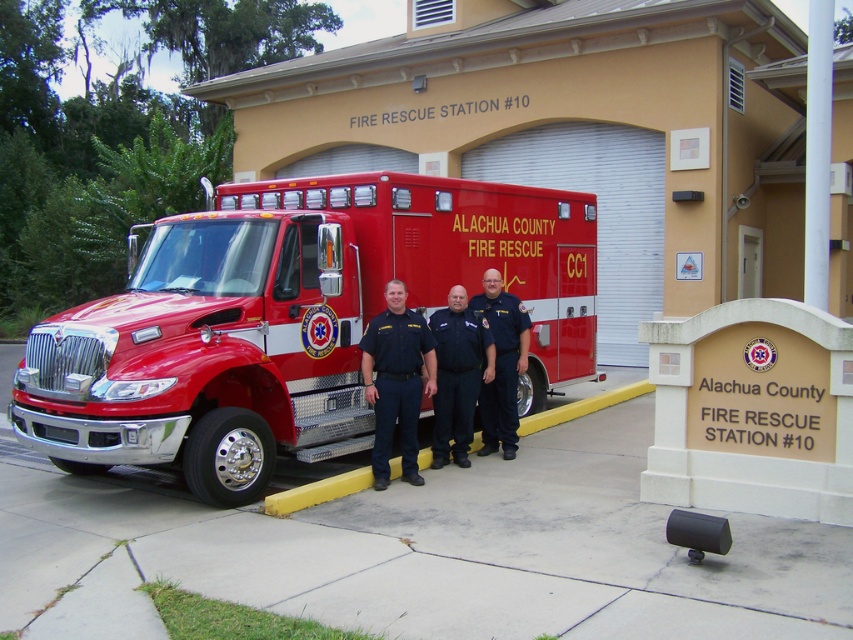
Does shiny red fire truck at center have a greater width compared to dark blue fabric uniform at center?

In fact, shiny red fire truck at center might be narrower than dark blue fabric uniform at center.

I want to click on shiny red fire truck at center, so click(x=291, y=321).

Who is higher up, shiny red fire truck at center or black uniform at center?

Positioned higher is black uniform at center.

Is shiny red fire truck at center positioned behind black uniform at center?

No, shiny red fire truck at center is closer to the viewer.

Is point (486, 236) positioned in front of point (387, 472)?

No, (486, 236) is behind (387, 472).

At what (x,y) coordinates should I click in order to perform the action: click on shiny red fire truck at center. Please return your answer as a coordinate pair (x, y). Looking at the image, I should click on [291, 321].

Is dark blue fabric uniform at center further to the viewer compared to blue fabric uniform at center?

No, dark blue fabric uniform at center is closer to the viewer.

Is dark blue fabric uniform at center to the right of blue fabric uniform at center from the viewer's perspective?

Incorrect, dark blue fabric uniform at center is not on the right side of blue fabric uniform at center.

Is point (479, 385) positioned in front of point (517, 330)?

Yes, it is in front of point (517, 330).

The width and height of the screenshot is (853, 640). In order to click on dark blue fabric uniform at center in this screenshot , I will do `click(456, 376)`.